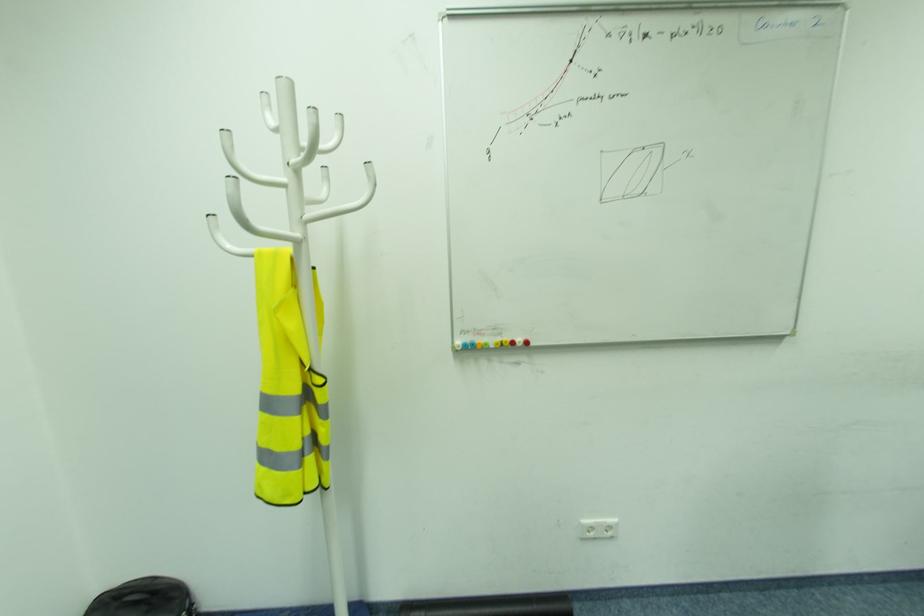
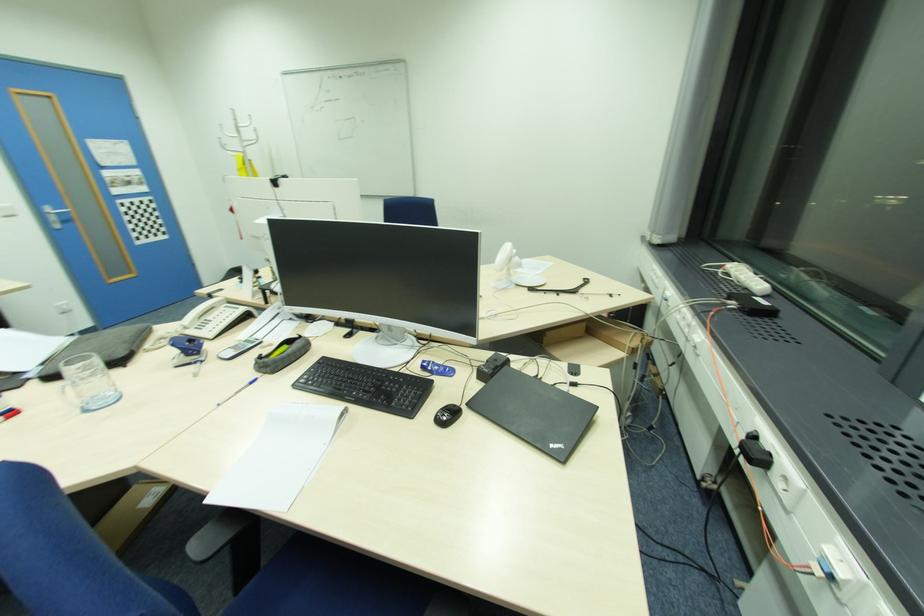
The images are taken continuously from a first-person perspective. In which direction are you moving?

The cameraman moved toward right, backward.